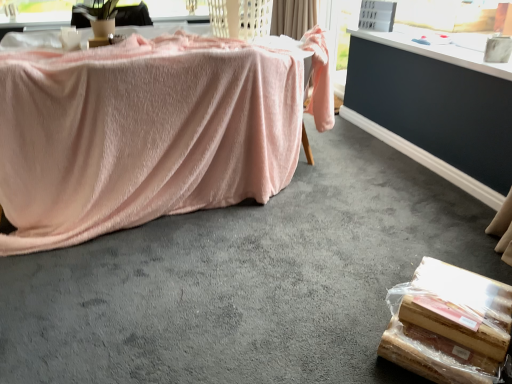
Identify the location of wooden board at lower right. This screenshot has height=384, width=512. (449, 325).

Where is `pink fabric-covered object at left`? pink fabric-covered object at left is located at coordinates (246, 280).

From a real-world perspective, relative to pink fabric-covered object at left, is dark gray carpet at lower right vertically above or below?

dark gray carpet at lower right is situated higher than pink fabric-covered object at left in the real world.

Is dark gray carpet at lower right next to pink fabric-covered object at left?

No, dark gray carpet at lower right is not next to pink fabric-covered object at left.

Could you tell me if dark gray carpet at lower right is facing pink fabric-covered object at left?

Yes, dark gray carpet at lower right faces towards pink fabric-covered object at left.

Considering their positions, is dark gray carpet at lower right located in front of or behind pink fabric-covered object at left?

dark gray carpet at lower right is behind pink fabric-covered object at left.

Is beige fabric curtain at upper center looking in the opposite direction of pink fabric-covered object at left?

No, pink fabric-covered object at left is not at the back of beige fabric curtain at upper center.

How distant is beige fabric curtain at upper center from pink fabric-covered object at left?

7.88 feet.

Relative to pink fabric-covered object at left, is beige fabric curtain at upper center in front or behind?

Clearly, beige fabric curtain at upper center is behind pink fabric-covered object at left.

Which is nearer, (306, 22) or (146, 261)?

Positioned in front is point (146, 261).

From the image's perspective, which one is positioned lower, wooden board at lower right or dark gray carpet at lower right?

wooden board at lower right.

Can you confirm if wooden board at lower right is thinner than dark gray carpet at lower right?

No, wooden board at lower right is not thinner than dark gray carpet at lower right.

Does wooden board at lower right appear on the left side of dark gray carpet at lower right?

Yes, wooden board at lower right is to the left of dark gray carpet at lower right.

Could dark gray carpet at lower right be considered to be inside wooden board at lower right?

No, dark gray carpet at lower right is not surrounded by wooden board at lower right.

In the scene shown: Between wooden board at lower right and pink fabric-covered object at left, which one is positioned behind?

wooden board at lower right is further from the camera.

Is wooden board at lower right beside pink fabric-covered object at left?

No, wooden board at lower right is not making contact with pink fabric-covered object at left.

Which object is wider, wooden board at lower right or pink fabric-covered object at left?

pink fabric-covered object at left is wider.

Is wooden board at lower right not inside pink fabric-covered object at left?

Absolutely, wooden board at lower right is external to pink fabric-covered object at left.

Choose the correct answer: Is beige fabric curtain at upper center inside wooden board at lower right or outside it?

beige fabric curtain at upper center cannot be found inside wooden board at lower right.

From the image's perspective, is beige fabric curtain at upper center located above wooden board at lower right?

Yes, from the image's perspective, beige fabric curtain at upper center is above wooden board at lower right.

Where is `curtain above the wooden board at lower right (from the image's perspective)`? The height and width of the screenshot is (384, 512). curtain above the wooden board at lower right (from the image's perspective) is located at coordinates click(x=293, y=17).

Considering the positions of objects pink fabric-covered object at left and beige fabric curtain at upper center in the image provided, who is more to the right, pink fabric-covered object at left or beige fabric curtain at upper center?

beige fabric curtain at upper center.

From the picture: From a real-world perspective, is pink fabric-covered object at left located higher than beige fabric curtain at upper center?

No, from a real-world perspective, pink fabric-covered object at left is not above beige fabric curtain at upper center.

Which of these two, pink fabric-covered object at left or beige fabric curtain at upper center, is thinner?

beige fabric curtain at upper center is thinner.

Which object is closer to the camera, pink fabric-covered object at left or beige fabric curtain at upper center?

pink fabric-covered object at left is in front.

Can you confirm if pink fabric-covered object at left is thinner than dark gray carpet at lower right?

In fact, pink fabric-covered object at left might be wider than dark gray carpet at lower right.

Considering the relative positions of pink fabric-covered object at left and dark gray carpet at lower right in the image provided, is pink fabric-covered object at left to the left or to the right of dark gray carpet at lower right?

In the image, pink fabric-covered object at left appears on the left side of dark gray carpet at lower right.

Measure the distance from pink fabric-covered object at left to dark gray carpet at lower right.

pink fabric-covered object at left and dark gray carpet at lower right are 38.50 inches apart from each other.

From their relative heights in the image, would you say pink fabric-covered object at left is taller or shorter than dark gray carpet at lower right?

In the image, pink fabric-covered object at left appears to be shorter than dark gray carpet at lower right.

The width and height of the screenshot is (512, 384). What are the coordinates of `table behind the pink fabric-covered object at left` in the screenshot? It's located at point(434,109).

At what (x,y) coordinates should I click in order to perform the action: click on concrete in front of the beige fabric curtain at upper center. Please return your answer as a coordinate pair (x, y). Image resolution: width=512 pixels, height=384 pixels. Looking at the image, I should click on (246, 280).

Based on their spatial positions, is beige fabric curtain at upper center or wooden board at lower right further from dark gray carpet at lower right?

wooden board at lower right is positioned further to the anchor dark gray carpet at lower right.

When comparing their distances from pink fabric-covered object at left, does wooden board at lower right or beige fabric curtain at upper center seem further?

beige fabric curtain at upper center is further to pink fabric-covered object at left.

Looking at the image, which one is located further to beige fabric curtain at upper center, wooden board at lower right or pink fabric-covered object at left?

wooden board at lower right is further to beige fabric curtain at upper center.

Which object lies further to the anchor point beige fabric curtain at upper center, pink fabric-covered object at left or wooden board at lower right?

wooden board at lower right is positioned further to the anchor beige fabric curtain at upper center.

From the image, which object appears to be farther from wooden board at lower right, pink fabric-covered object at left or dark gray carpet at lower right?

dark gray carpet at lower right.

Looking at the image, which one is located further to wooden board at lower right, dark gray carpet at lower right or pink fabric-covered object at left?

dark gray carpet at lower right.

Estimate the real-world distances between objects in this image. Which object is further from dark gray carpet at lower right, wooden board at lower right or pink fabric-covered object at left?

wooden board at lower right is positioned further to the anchor dark gray carpet at lower right.

Consider the image. From the image, which object appears to be farther from beige fabric curtain at upper center, wooden board at lower right or dark gray carpet at lower right?

wooden board at lower right is further to beige fabric curtain at upper center.

The height and width of the screenshot is (384, 512). I want to click on table located between wooden board at lower right and beige fabric curtain at upper center in the depth direction, so [x=434, y=109].

What are the coordinates of `food between pink fabric-covered object at left and dark gray carpet at lower right from front to back` in the screenshot? It's located at (449, 325).

Where is `table located between pink fabric-covered object at left and beige fabric curtain at upper center in the depth direction`? This screenshot has height=384, width=512. table located between pink fabric-covered object at left and beige fabric curtain at upper center in the depth direction is located at coordinates (434, 109).

Identify the location of food between pink fabric-covered object at left and beige fabric curtain at upper center along the z-axis. (449, 325).